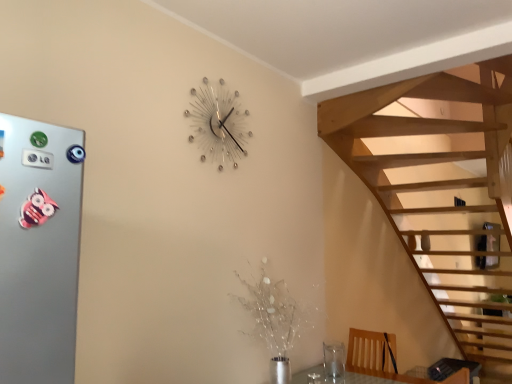
What is the approximate height of transparent glass vase at lower right?

7.48 inches.

This screenshot has width=512, height=384. Find the location of `metallic silver wall clock at upper center`. metallic silver wall clock at upper center is located at coordinates (218, 124).

Considering the sizes of metallic silver wall clock at upper center and transparent glass vase at lower right in the image, is metallic silver wall clock at upper center taller or shorter than transparent glass vase at lower right?

In the image, metallic silver wall clock at upper center appears to be taller than transparent glass vase at lower right.

Image resolution: width=512 pixels, height=384 pixels. In the image, there is a transparent glass vase at lower right. What are the coordinates of `wall clock above it (from the image's perspective)` in the screenshot? It's located at (218, 124).

Is metallic silver wall clock at upper center smaller than transparent glass vase at lower right?

No.

Can you confirm if metallic silver wall clock at upper center is positioned to the left of transparent glass vase at lower right?

Indeed, metallic silver wall clock at upper center is positioned on the left side of transparent glass vase at lower right.

Is metallic silver wall clock at upper center bigger than silver metallic button at left?

Correct, metallic silver wall clock at upper center is larger in size than silver metallic button at left.

Does metallic silver wall clock at upper center have a greater height compared to silver metallic button at left?

Yes.

From the image's perspective, is metallic silver wall clock at upper center located above silver metallic button at left?

Correct, metallic silver wall clock at upper center appears higher than silver metallic button at left in the image.

Is metallic silver wall clock at upper center facing towards silver metallic button at left?

No, metallic silver wall clock at upper center does not turn towards silver metallic button at left.

The height and width of the screenshot is (384, 512). Find the location of `button above the transparent glass vase at lower right (from a real-world perspective)`. button above the transparent glass vase at lower right (from a real-world perspective) is located at coordinates (37, 159).

Which of these two, silver metallic button at left or transparent glass vase at lower right, stands taller?

Standing taller between the two is transparent glass vase at lower right.

Is silver metallic button at left bigger than transparent glass vase at lower right?

Actually, silver metallic button at left might be smaller than transparent glass vase at lower right.

Is silver metallic button at left touching transparent glass vase at lower right?

No, silver metallic button at left is not making contact with transparent glass vase at lower right.

Is silver metallic button at left aimed at metallic silver wall clock at upper center?

No, silver metallic button at left is not facing towards metallic silver wall clock at upper center.

The image size is (512, 384). I want to click on button on the left of metallic silver wall clock at upper center, so click(37, 159).

Is silver metallic button at left bigger than metallic silver wall clock at upper center?

No.

Between point (337, 365) and point (31, 156), which one is positioned behind?

The point (337, 365) is farther from the camera.

From the image's perspective, is transparent glass vase at lower right positioned above or below silver metallic button at left?

Based on their image positions, transparent glass vase at lower right is located beneath silver metallic button at left.

Is transparent glass vase at lower right looking in the opposite direction of silver metallic button at left?

No.

Between transparent glass vase at lower right and metallic silver wall clock at upper center, which one appears on the left side from the viewer's perspective?

Positioned to the left is metallic silver wall clock at upper center.

How many degrees apart are the facing directions of transparent glass vase at lower right and metallic silver wall clock at upper center?

The facing directions of transparent glass vase at lower right and metallic silver wall clock at upper center are 0.358 degrees apart.

Is metallic silver wall clock at upper center inside transparent glass vase at lower right?

No, metallic silver wall clock at upper center is located outside of transparent glass vase at lower right.

Consider the image. Which object is wider, transparent glass vase at lower right or metallic silver wall clock at upper center?

transparent glass vase at lower right is wider.

You are a GUI agent. You are given a task and a screenshot of the screen. Output one action in this format:
    pyautogui.click(x=<x>, y=<y>)
    Task: Click on the glass vase lying below the metallic silver wall clock at upper center (from the image's perspective)
    This screenshot has width=512, height=384.
    Given the screenshot: What is the action you would take?
    pyautogui.click(x=334, y=361)

I want to click on button below the metallic silver wall clock at upper center (from a real-world perspective), so click(x=37, y=159).

Looking at the image, which one is located further to metallic silver wall clock at upper center, silver metallic button at left or transparent glass vase at lower right?

transparent glass vase at lower right lies further to metallic silver wall clock at upper center than the other object.

When comparing their distances from metallic silver wall clock at upper center, does transparent glass vase at lower right or silver metallic button at left seem closer?

Based on the image, silver metallic button at left appears to be nearer to metallic silver wall clock at upper center.

When comparing their distances from transparent glass vase at lower right, does silver metallic button at left or metallic silver wall clock at upper center seem further?

silver metallic button at left is positioned further to the anchor transparent glass vase at lower right.

Which object lies further to the anchor point transparent glass vase at lower right, metallic silver wall clock at upper center or silver metallic button at left?

Based on the image, silver metallic button at left appears to be further to transparent glass vase at lower right.

Based on their spatial positions, is transparent glass vase at lower right or metallic silver wall clock at upper center further from silver metallic button at left?

Among the two, transparent glass vase at lower right is located further to silver metallic button at left.

Looking at the image, which one is located closer to silver metallic button at left, metallic silver wall clock at upper center or transparent glass vase at lower right?

Among the two, metallic silver wall clock at upper center is located nearer to silver metallic button at left.

This screenshot has width=512, height=384. In order to click on wall clock positioned between silver metallic button at left and transparent glass vase at lower right from near to far in this screenshot , I will do `click(218, 124)`.